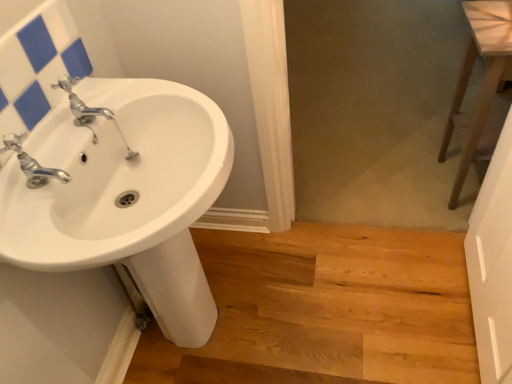
Question: From the image's perspective, is silver metallic faucet at left above or below light brown wood at lower center?

Choices:
 (A) below
 (B) above

Answer: (B)

Question: Considering their positions, is silver metallic faucet at left located in front of or behind light brown wood at lower center?

Choices:
 (A) front
 (B) behind

Answer: (A)

Question: Which is farther from the brown wooden stool at right?

Choices:
 (A) white glossy sink at left
 (B) silver metallic faucet at left
 (C) light brown wood at lower center
 (D) chrome metallic faucet at upper left
 (E) white glossy sink at upper left

Answer: (B)

Question: Estimate the real-world distances between objects in this image. Which object is closer to the white glossy sink at left?

Choices:
 (A) light brown wood at lower center
 (B) silver metallic faucet at left
 (C) white glossy sink at upper left
 (D) transparent glass screen door at right
 (E) chrome metallic faucet at upper left

Answer: (E)